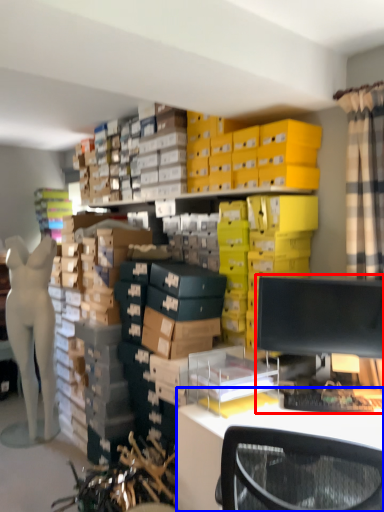
Question: Among these objects, which one is farthest to the camera, desktop computer (highlighted by a red box) or desk (highlighted by a blue box)?

Choices:
 (A) desktop computer
 (B) desk

Answer: (A)